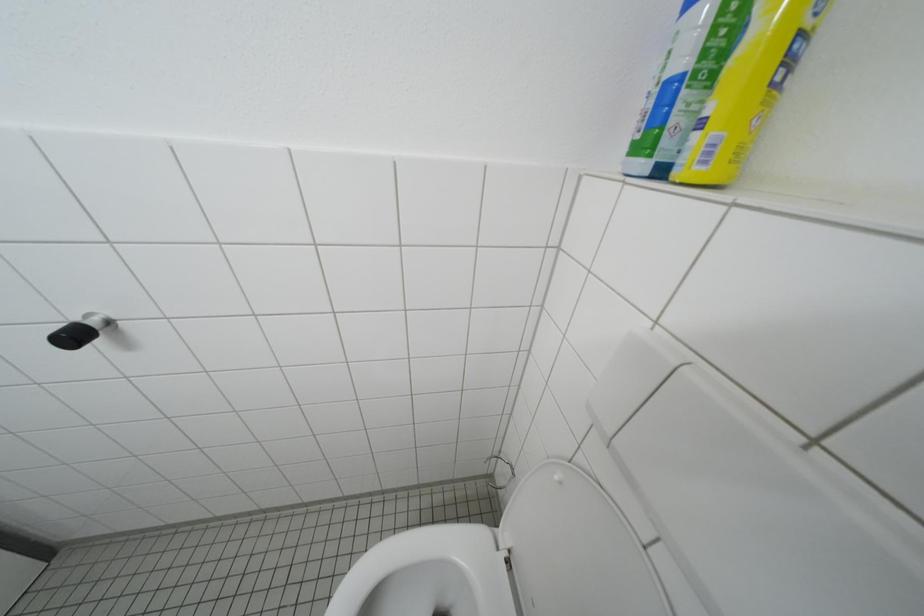
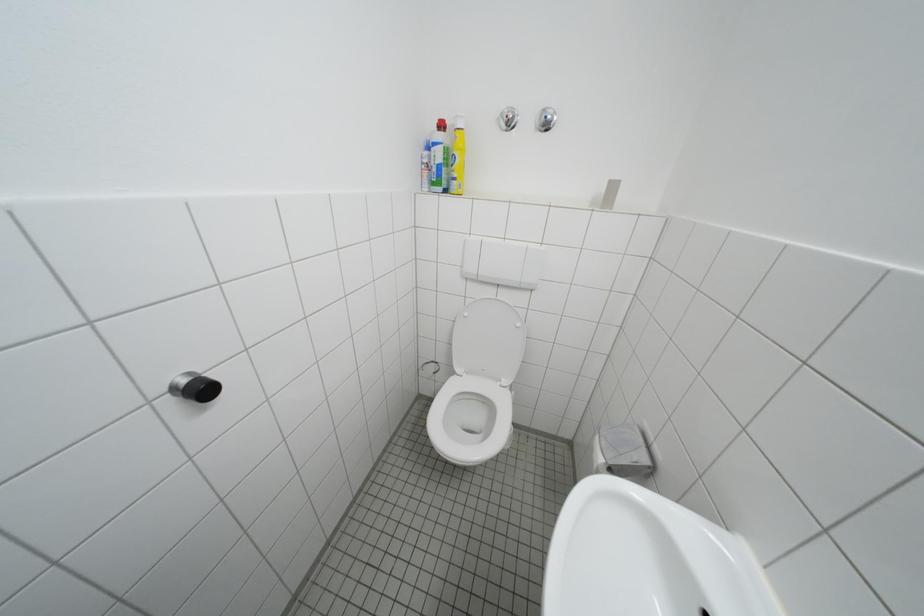
Question: The camera is either moving clockwise (left) or counter-clockwise (right) around the object. The first image is from the beginning of the video and the second image is from the end. Is the camera moving left or right when shooting the video?

Choices:
 (A) Left
 (B) Right

Answer: (A)